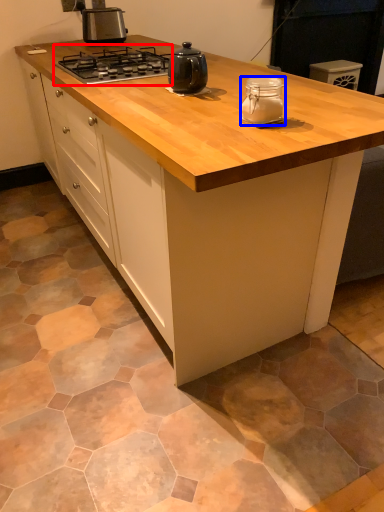
Question: Among these objects, which one is nearest to the camera, gas stove (highlighted by a red box) or kitchen appliance (highlighted by a blue box)?

Choices:
 (A) gas stove
 (B) kitchen appliance

Answer: (B)